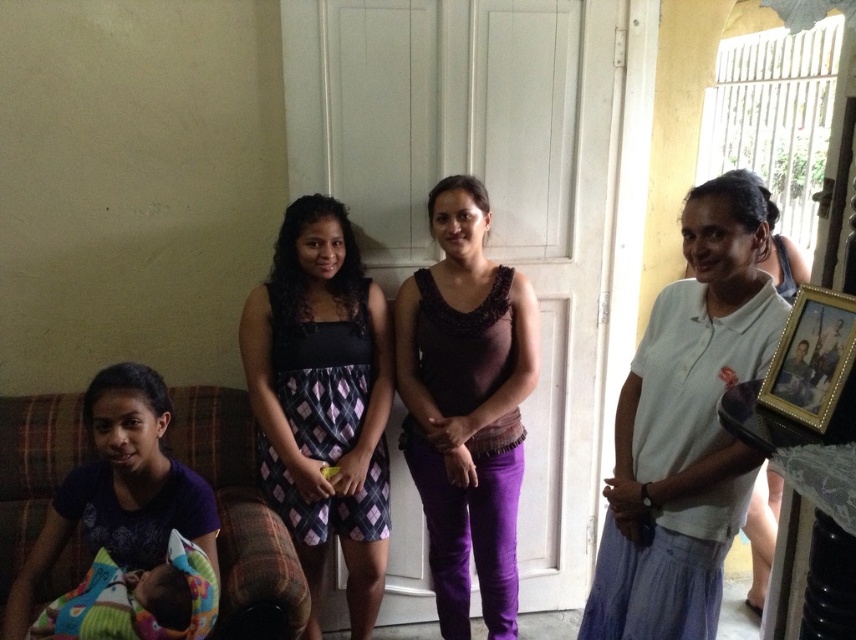
Question: Considering the real-world distances, which object is farthest from the white cotton shirt at right?

Choices:
 (A) fluffy multicolored blanket at lower left
 (B) purple velvet pants at center
 (C) plaid fabric dress at center
 (D) plaid fabric couch at lower left

Answer: (A)

Question: Which of the following is the farthest from the observer?

Choices:
 (A) plaid fabric couch at lower left
 (B) fluffy multicolored blanket at lower left
 (C) gold metallic photo frame at right
 (D) white cotton shirt at right

Answer: (A)

Question: Is fluffy multicolored blanket at lower left wider than gold metallic photo frame at right?

Choices:
 (A) yes
 (B) no

Answer: (A)

Question: Can you confirm if white cotton shirt at right is positioned to the left of fluffy multicolored blanket at lower left?

Choices:
 (A) yes
 (B) no

Answer: (B)

Question: Is the position of fluffy multicolored blanket at lower left more distant than that of gold metallic photo frame at right?

Choices:
 (A) yes
 (B) no

Answer: (A)

Question: Which of the following is the closest to the observer?

Choices:
 (A) purple velvet pants at center
 (B) fluffy multicolored blanket at lower left

Answer: (B)